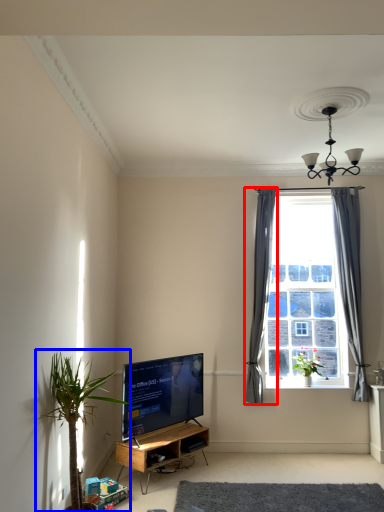
Question: Among these objects, which one is nearest to the camera, curtain (highlighted by a red box) or houseplant (highlighted by a blue box)?

Choices:
 (A) curtain
 (B) houseplant

Answer: (B)